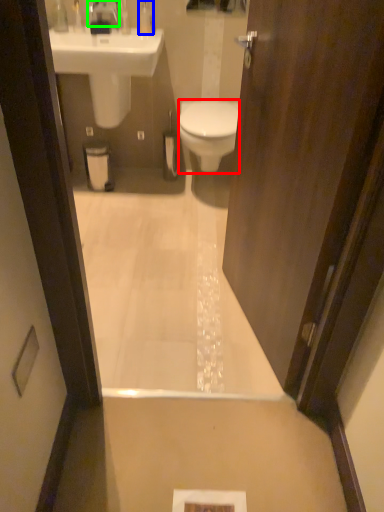
Question: Based on their relative distances, which object is farther from bidet (highlighted by a red box)? Choose from toiletry (highlighted by a blue box) and faucet (highlighted by a green box).

Choices:
 (A) toiletry
 (B) faucet

Answer: (B)